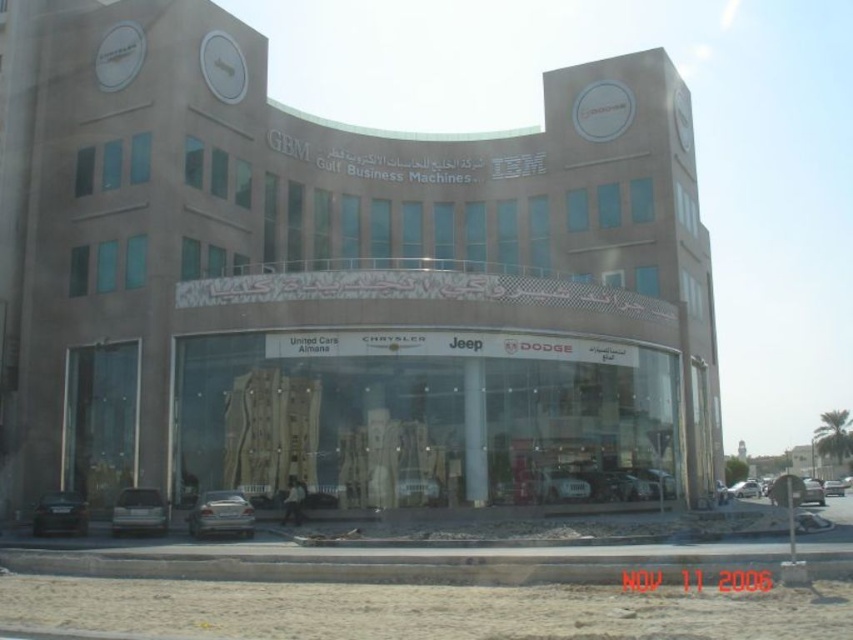
You are a delivery person standing at the entrance of the building. You need to park your 12 feet long truck between the satin silver sedan at lower center and the dark gray metallic sedan at lower left. Can you fit your truck between them without moving either car?

The distance between the satin silver sedan at lower center and the dark gray metallic sedan at lower left is 39.46 feet. Since your truck is only 12 feet long, there is enough space to park it between them without moving either car.

You are standing at the entrance of the building and want to locate the matte glass storefront at center. According to the coordinates, where should you look?

The matte glass storefront at center is located at coordinates point (339, 282), so you should look towards the center of the building slightly to the right and up from the bottom.